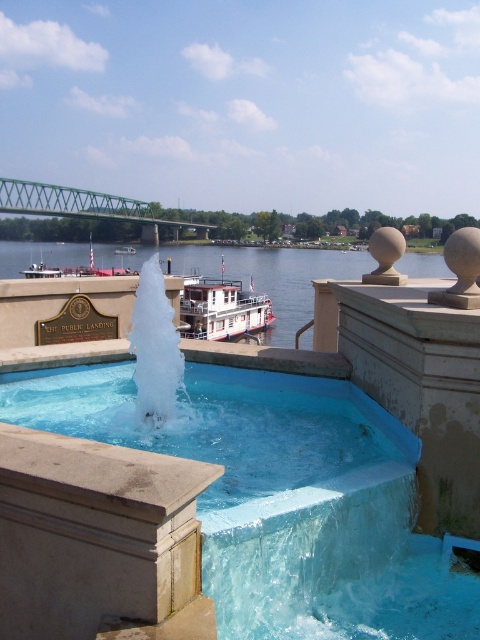
You are standing at the waterfront and want to take a photo of both the blue glossy fountain at center and the green metallic bridge at upper left. Which object should you position closer to the camera to include both in the frame?

The blue glossy fountain at center is below the green metallic bridge at upper left, so you should position the camera closer to the fountain to include both in the frame.

You are standing at the public landing and want to pour a drink into the blue glossy fountain at center without spilling. Which direction should you approach from to avoid the blue water at center?

The blue glossy fountain at center is located below the blue water at center, so approaching from above the blue water at center would allow you to pour the drink into the fountain without spilling.

You are standing on the public landing and want to take a photo of both the blue water at center and the green metallic bridge at upper left in the same frame. Given that your camera has a maximum focal length that allows capturing objects up to 15 meters apart, will you be able to include both in the photo?

The blue water at center and green metallic bridge at upper left are 16.48 meters apart, which exceeds the camera maximum focal length of 15 meters. Therefore, you cannot include both in the same photo frame.